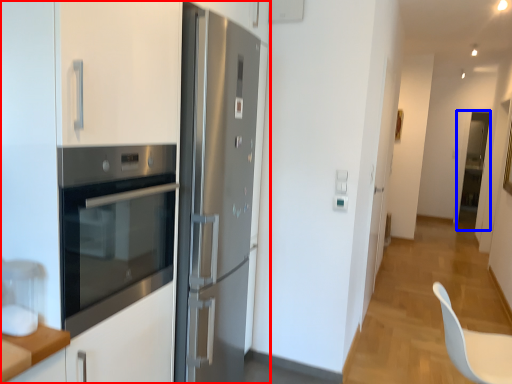
Question: Among these objects, which one is farthest to the camera, cabinetry (highlighted by a red box) or glass door (highlighted by a blue box)?

Choices:
 (A) cabinetry
 (B) glass door

Answer: (B)